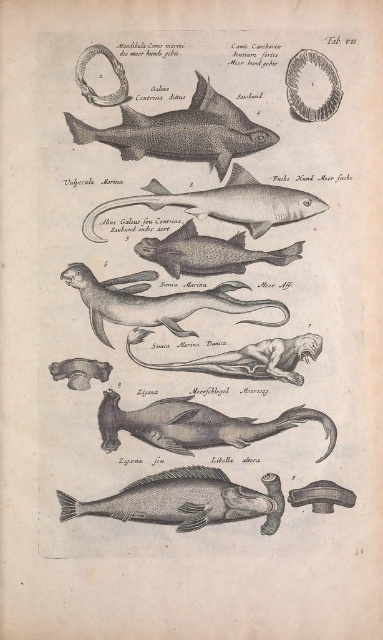
Which is in front, point (183, 500) or point (148, 282)?

Positioned in front is point (183, 500).

How distant is grayish matte fish at lower center from grayish matte seal at center?

grayish matte fish at lower center is 32.14 centimeters from grayish matte seal at center.

Locate an element on the screen. This screenshot has width=383, height=640. grayish matte fish at lower center is located at coordinates (184, 500).

Looking at this image, is gray matte shark at upper center thinner than grayish metallic sea creature at center?

Incorrect, gray matte shark at upper center's width is not less than grayish metallic sea creature at center's.

What do you see at coordinates (183, 131) in the screenshot? Image resolution: width=383 pixels, height=640 pixels. I see `gray matte shark at upper center` at bounding box center [183, 131].

Which is in front, point (199, 140) or point (212, 358)?

Positioned in front is point (199, 140).

The width and height of the screenshot is (383, 640). Identify the location of gray matte shark at upper center. (183, 131).

Does smooth gray seal at center come behind grayish metallic sea creature at center?

No, smooth gray seal at center is closer to the viewer.

Is point (49, 241) positioned before point (294, 355)?

Yes, point (49, 241) is closer to viewer.

At what (x,y) coordinates should I click in order to perform the action: click on smooth gray seal at center. Please return your answer as a coordinate pair (x, y). Looking at the image, I should click on (191, 285).